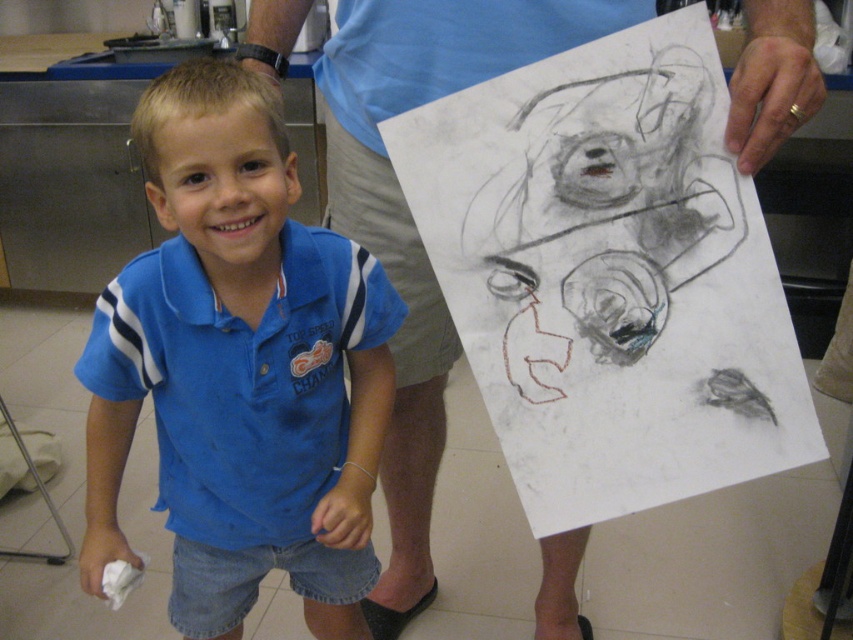
Question: Is charcoal sketch at upper center below blue cotton shirt at upper center?

Choices:
 (A) no
 (B) yes

Answer: (A)

Question: Estimate the real-world distances between objects in this image. Which object is closer to the blue cotton shirt at upper center?

Choices:
 (A) charcoal sketch at upper center
 (B) blue cotton shirt at center

Answer: (A)

Question: Estimate the real-world distances between objects in this image. Which object is closer to the blue cotton shirt at center?

Choices:
 (A) charcoal sketch at upper center
 (B) blue cotton shirt at upper center

Answer: (B)

Question: Estimate the real-world distances between objects in this image. Which object is farther from the blue cotton shirt at upper center?

Choices:
 (A) blue cotton shirt at center
 (B) charcoal sketch at upper center

Answer: (A)

Question: Observing the image, what is the correct spatial positioning of blue cotton shirt at center in reference to blue cotton shirt at upper center?

Choices:
 (A) left
 (B) right

Answer: (A)

Question: Is blue cotton shirt at center wider than charcoal sketch at upper center?

Choices:
 (A) no
 (B) yes

Answer: (B)